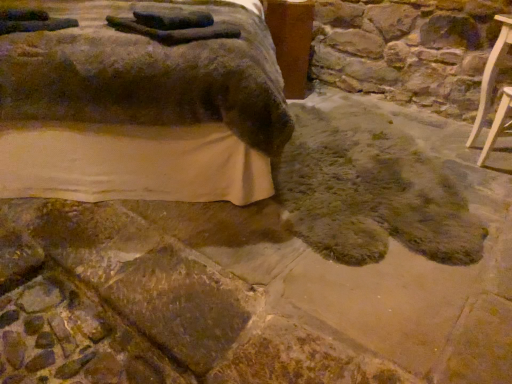
Find the location of a particular element. vacant space underneath light wood chair at right, which is the second furniture in left-to-right order (from a real-world perspective) is located at coordinates (499, 178).